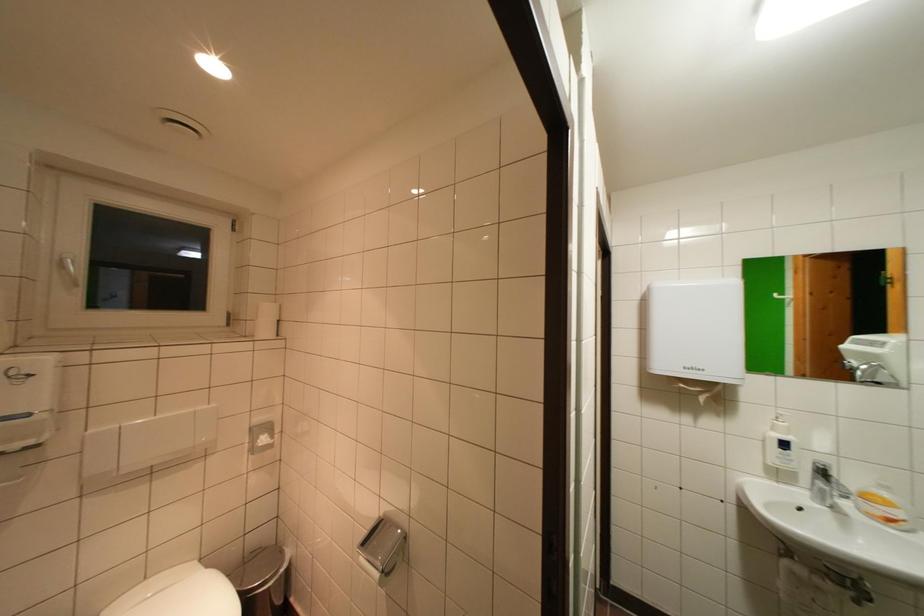
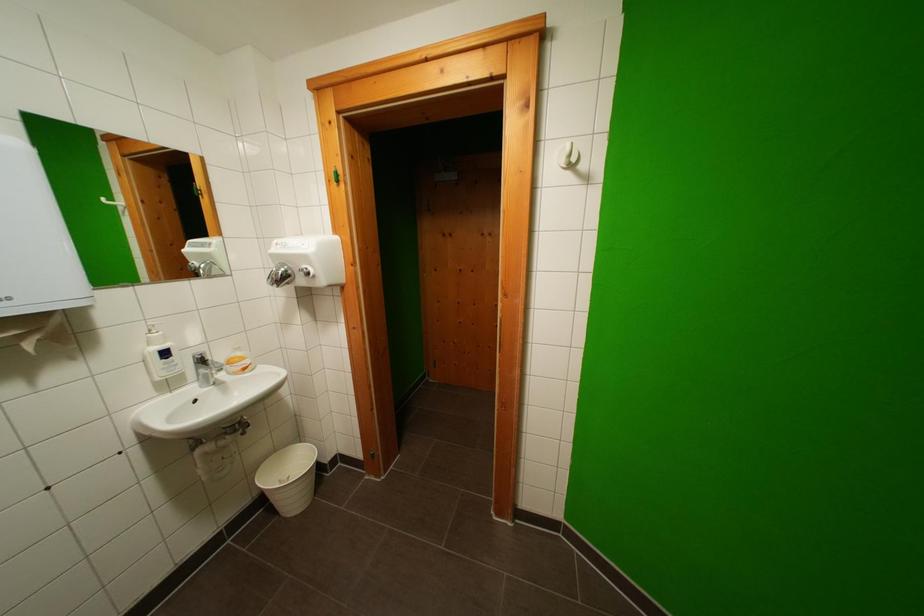
Where in the second image is the point corresponding to the point at 723,387 from the first image?

(55, 317)